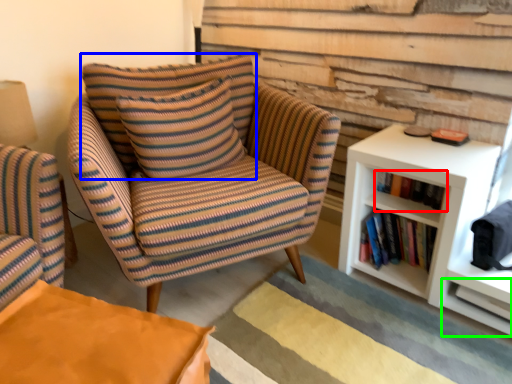
Question: Considering the real-world distances, which object is closest to book (highlighted by a red box)? pillow (highlighted by a blue box) or shelf (highlighted by a green box).

Choices:
 (A) pillow
 (B) shelf

Answer: (B)